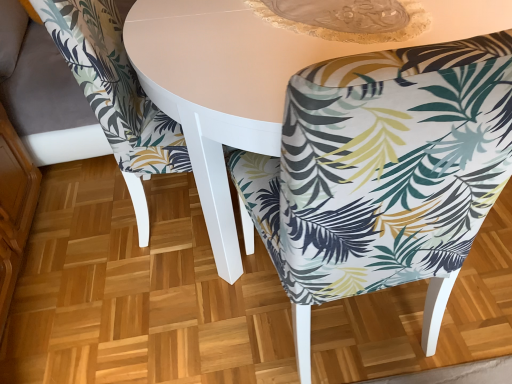
Question: Is printed fabric chair at center, placed as the first chair when sorted from right to left, positioned with its back to white glossy table at center?

Choices:
 (A) yes
 (B) no

Answer: (A)

Question: From a real-world perspective, is printed fabric chair at center, placed as the first chair when sorted from right to left, under white glossy table at center?

Choices:
 (A) no
 (B) yes

Answer: (A)

Question: Is white glossy table at center completely or partially inside printed fabric chair at center, placed as the first chair when sorted from right to left?

Choices:
 (A) yes
 (B) no

Answer: (B)

Question: Considering the relative sizes of printed fabric chair at center, which ranks as the 2th chair in left-to-right order, and white glossy table at center in the image provided, is printed fabric chair at center, which ranks as the 2th chair in left-to-right order, thinner than white glossy table at center?

Choices:
 (A) no
 (B) yes

Answer: (B)

Question: Is printed fabric chair at center, which ranks as the 2th chair in left-to-right order, taller than white glossy table at center?

Choices:
 (A) yes
 (B) no

Answer: (A)

Question: Considering the relative positions of printed fabric chair at center, which ranks as the 2th chair in left-to-right order, and white glossy table at center in the image provided, is printed fabric chair at center, which ranks as the 2th chair in left-to-right order, to the right of white glossy table at center from the viewer's perspective?

Choices:
 (A) yes
 (B) no

Answer: (A)

Question: Considering the relative positions of printed fabric chair at center, which ranks as the 2th chair in left-to-right order, and printed fabric chair at center, marked as the second chair in a right-to-left arrangement, in the image provided, is printed fabric chair at center, which ranks as the 2th chair in left-to-right order, behind printed fabric chair at center, marked as the second chair in a right-to-left arrangement,?

Choices:
 (A) yes
 (B) no

Answer: (B)

Question: Is printed fabric chair at center, which ranks as the 2th chair in left-to-right order, aimed at printed fabric chair at center, marked as the second chair in a right-to-left arrangement?

Choices:
 (A) yes
 (B) no

Answer: (A)

Question: Is printed fabric chair at center, which ranks as the 2th chair in left-to-right order, wider than printed fabric chair at center, arranged as the 1th chair when viewed from the left?

Choices:
 (A) yes
 (B) no

Answer: (B)

Question: Can you confirm if printed fabric chair at center, which ranks as the 2th chair in left-to-right order, is positioned to the left of printed fabric chair at center, arranged as the 1th chair when viewed from the left?

Choices:
 (A) no
 (B) yes

Answer: (A)

Question: Is printed fabric chair at center, placed as the first chair when sorted from right to left, smaller than printed fabric chair at center, marked as the second chair in a right-to-left arrangement?

Choices:
 (A) no
 (B) yes

Answer: (B)

Question: Is printed fabric chair at center, placed as the first chair when sorted from right to left, closer to camera compared to printed fabric chair at center, arranged as the 1th chair when viewed from the left?

Choices:
 (A) yes
 (B) no

Answer: (A)

Question: Considering the relative sizes of white glossy table at center and printed fabric chair at center, arranged as the 1th chair when viewed from the left, in the image provided, is white glossy table at center taller than printed fabric chair at center, arranged as the 1th chair when viewed from the left,?

Choices:
 (A) no
 (B) yes

Answer: (A)